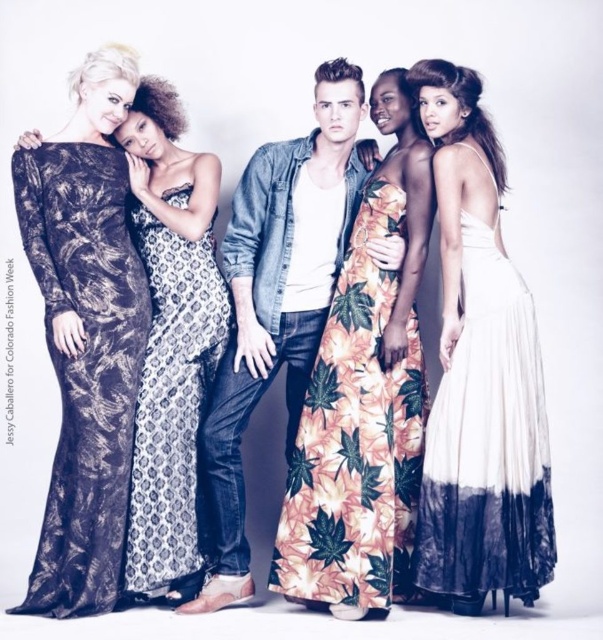
Which is below, floral print fabric dress at center or printed silk dress at center?

floral print fabric dress at center

Which is more to the left, floral print fabric dress at center or printed silk dress at center?

printed silk dress at center

Which is in front, point (371, 604) or point (153, 378)?

Point (371, 604) is more forward.

Identify the location of floral print fabric dress at center. The image size is (603, 640). (356, 438).

Who is shorter, metallic lace gown at left or denim shirt at center?

Standing shorter between the two is metallic lace gown at left.

Is metallic lace gown at left above denim shirt at center?

Actually, metallic lace gown at left is below denim shirt at center.

Measure the distance between point (112,609) and camera.

Point (112,609) and camera are 2.96 meters apart.

I want to click on metallic lace gown at left, so click(84, 365).

Does white pleated dress at right have a lesser height compared to floral print fabric dress at center?

In fact, white pleated dress at right may be taller than floral print fabric dress at center.

Locate an element on the screen. The image size is (603, 640). white pleated dress at right is located at coordinates (479, 372).